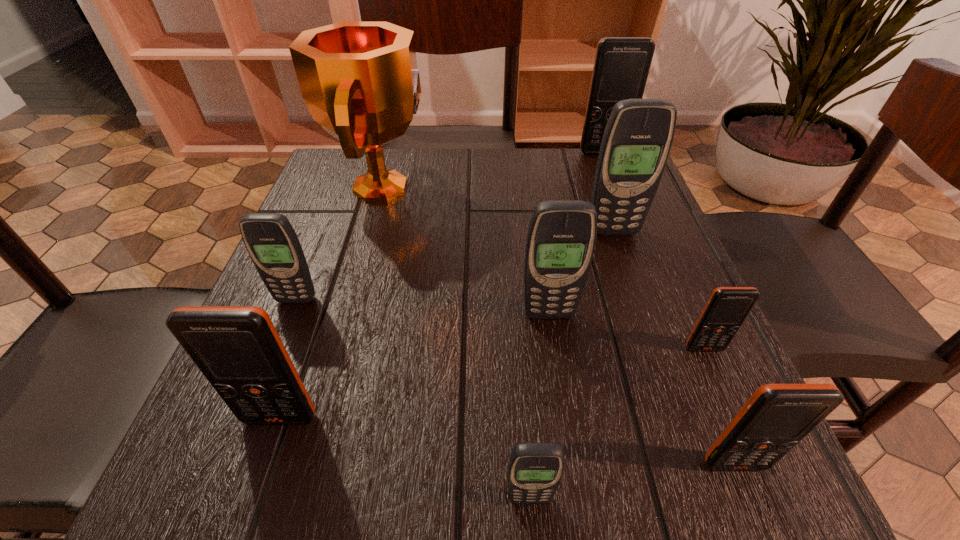
In order to click on award in this screenshot , I will do `click(359, 80)`.

Find the location of `the farthest cellular telephone`. the farthest cellular telephone is located at coordinates (621, 67).

Locate an element on the screen. Image resolution: width=960 pixels, height=540 pixels. the biggest orange cellular telephone is located at coordinates [x=621, y=67].

Identify the location of the farthest gray cellular telephone. (636, 143).

Where is `the rightmost gray cellular telephone`? The image size is (960, 540). the rightmost gray cellular telephone is located at coordinates (636, 143).

Find the location of a particular element. the second biggest orange cellular telephone is located at coordinates (237, 348).

Where is `the third nearest object`? the third nearest object is located at coordinates (237, 348).

Locate an element on the screen. This screenshot has height=540, width=960. the second nearest gray cellular telephone is located at coordinates (561, 238).

Identify the location of the fifth nearest object. (561, 238).

This screenshot has height=540, width=960. I want to click on the sixth nearest object, so click(272, 243).